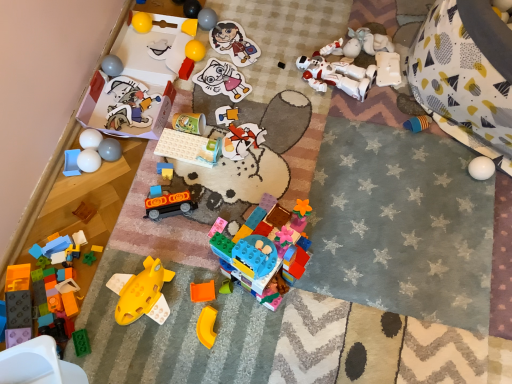
The image size is (512, 384). What are the coordinates of `vacant area that lies between yellow rubber ball at upper center, the tenth toy from the right, and white matte robot at center, which is counted as the 21th toy, starting from the left` in the screenshot? It's located at (258, 67).